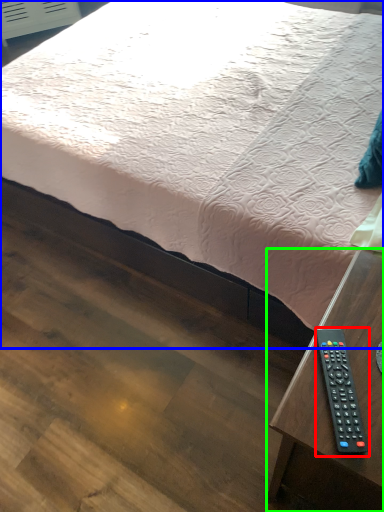
Question: Which object is positioned farthest from remote control (highlighted by a red box)? Select from bed (highlighted by a blue box) and table (highlighted by a green box).

Choices:
 (A) bed
 (B) table

Answer: (A)